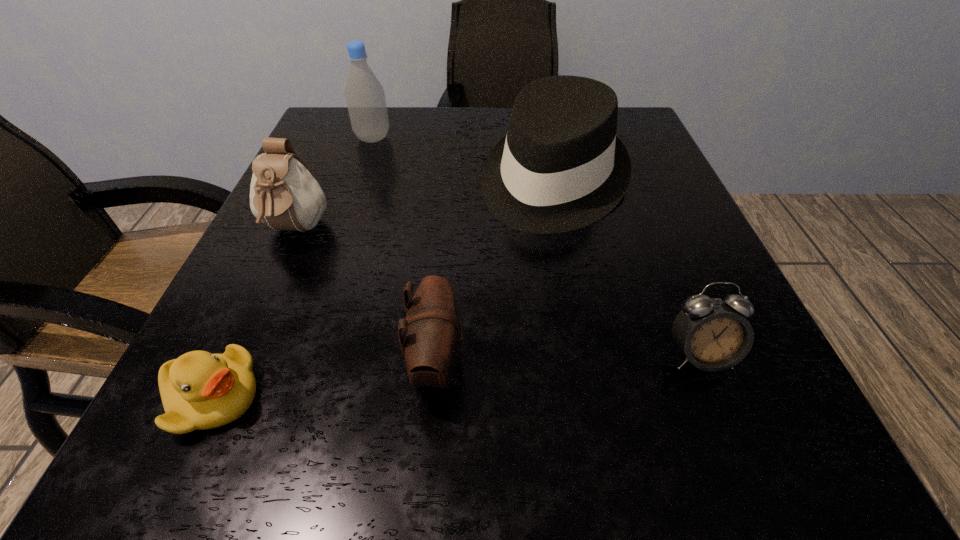
The height and width of the screenshot is (540, 960). I want to click on bottle, so click(x=365, y=97).

Find the location of a particular element. fedora is located at coordinates (561, 167).

Where is `the taller pouch`? the taller pouch is located at coordinates (284, 195).

What are the coordinates of `the farther pouch` in the screenshot? It's located at (284, 195).

I want to click on the fourth object from left to right, so click(431, 338).

At what (x,y) coordinates should I click in order to perform the action: click on the nearer pouch. Please return your answer as a coordinate pair (x, y). Looking at the image, I should click on (431, 338).

Image resolution: width=960 pixels, height=540 pixels. Find the location of `alarm clock`. alarm clock is located at coordinates (713, 336).

At what (x,y) coordinates should I click in order to perform the action: click on the shortest object. Please return your answer as a coordinate pair (x, y). Looking at the image, I should click on (199, 390).

Find the location of `free space located 0.180m on the right of the bottle`. free space located 0.180m on the right of the bottle is located at coordinates (473, 138).

Image resolution: width=960 pixels, height=540 pixels. I want to click on free spot located on the front of the fedora, so click(x=608, y=442).